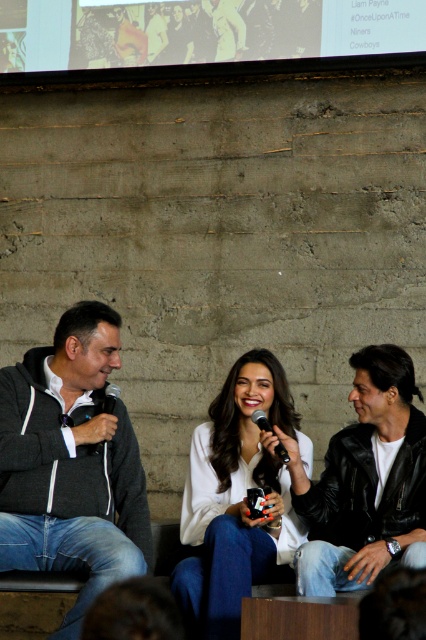
You are an event photographer who needs to capture a clear shot of both the dark gray hoodie at left and the black matte microphone at center. Based on their positions, can you determine which one is closer to the bottom of the frame?

The dark gray hoodie at left is below the black matte microphone at center, so the dark gray hoodie at left is closer to the bottom of the frame.

You are organizing a photo shoot and need to ensure that the black leather jacket at center and the metallic silver microphone at center are both visible in the frame. Given that the camera has a fixed focal length, which object should you prioritize positioning closer to the camera to ensure both are fully captured?

The black leather jacket at center is wider than the metallic silver microphone at center, so you should prioritize positioning the black leather jacket at center closer to the camera to ensure both are fully captured.